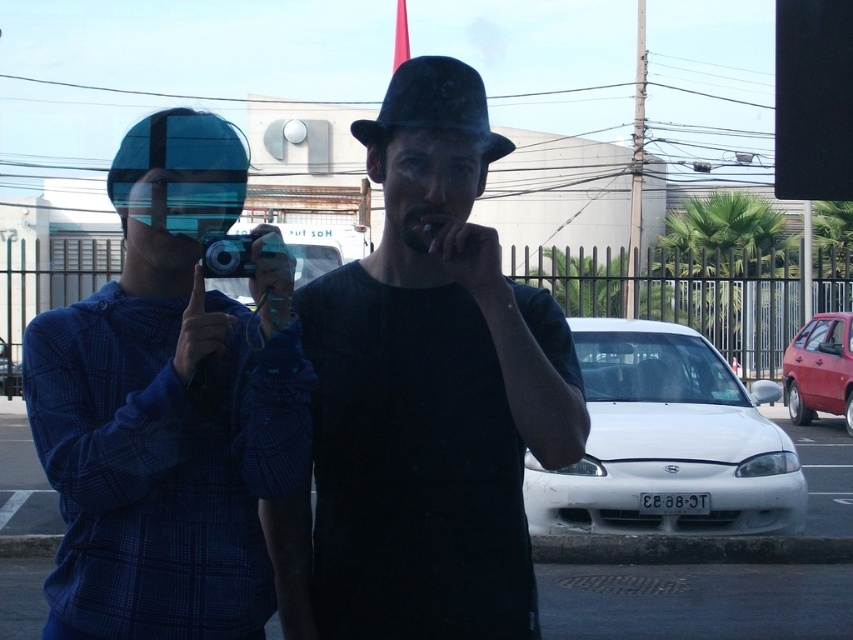
Question: Does blue plaid sweater at left appear under matte black hat at center?

Choices:
 (A) yes
 (B) no

Answer: (A)

Question: Which object is farther from the camera taking this photo?

Choices:
 (A) matte red hatchback at right
 (B) black felt fedora at center
 (C) blue plaid sweater at left

Answer: (A)

Question: Among these points, which one is farthest from the camera?

Choices:
 (A) (527, 506)
 (B) (432, 88)
 (C) (445, 436)
 (D) (183, 216)

Answer: (A)

Question: Where is black matte hat at center located in relation to blue plaid sweater at left in the image?

Choices:
 (A) below
 (B) above

Answer: (B)

Question: Can you confirm if black matte hat at center is positioned to the right of black felt fedora at center?

Choices:
 (A) yes
 (B) no

Answer: (A)

Question: Which of the following is the closest to the observer?

Choices:
 (A) matte black hat at center
 (B) black felt fedora at center
 (C) matte red hatchback at right

Answer: (A)